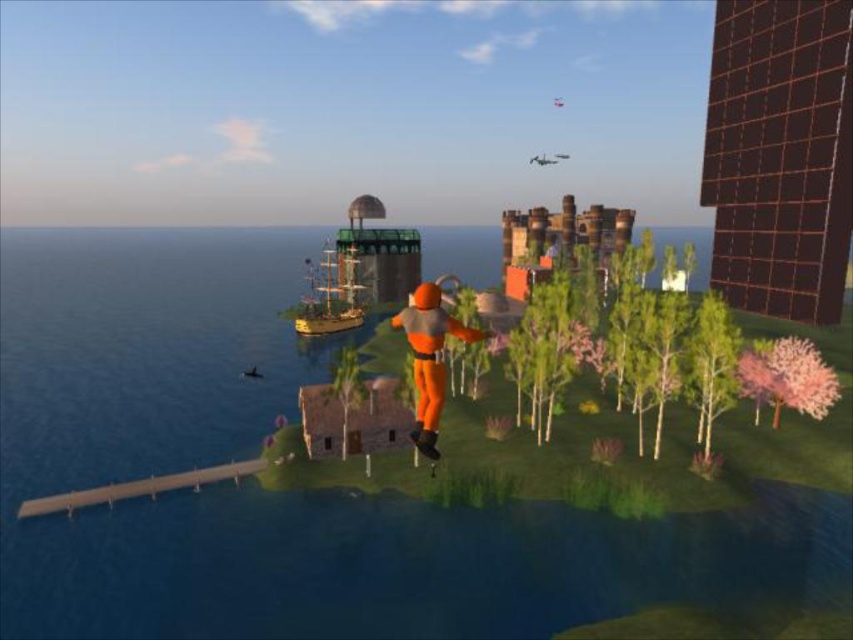
You are standing at the point marked as point (x=399, y=324) in the image. If you want to take a photo of the entire island, which direction should you move to get a better view?

Since the point (x=399, y=324) is 29.80 meters away from the camera, you should move further away from the island to capture a wider view.

From the picture: You are the character in the image wearing the orange matte jumpsuit at center. You want to land safely on the ground below. Is the transparent blue water at center between you and the ground?

Yes, the transparent blue water at center is between you and the ground, so you need to avoid it or find another path to land safely.

You are the character in the orange matte jumpsuit at center. You want to land near the pink fluffy tree at lower right. The safe landing distance is 50 feet. Is the current distance safe?

The distance between the orange matte jumpsuit at center and the pink fluffy tree at lower right is 54.57 feet, which exceeds the safe landing distance of 50 feet. Therefore, the current distance is not safe for landing.